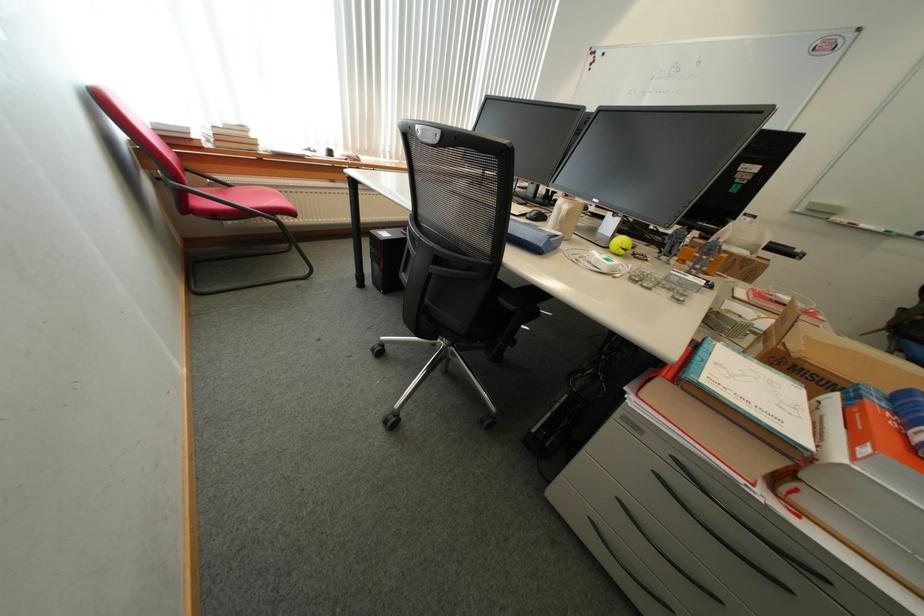
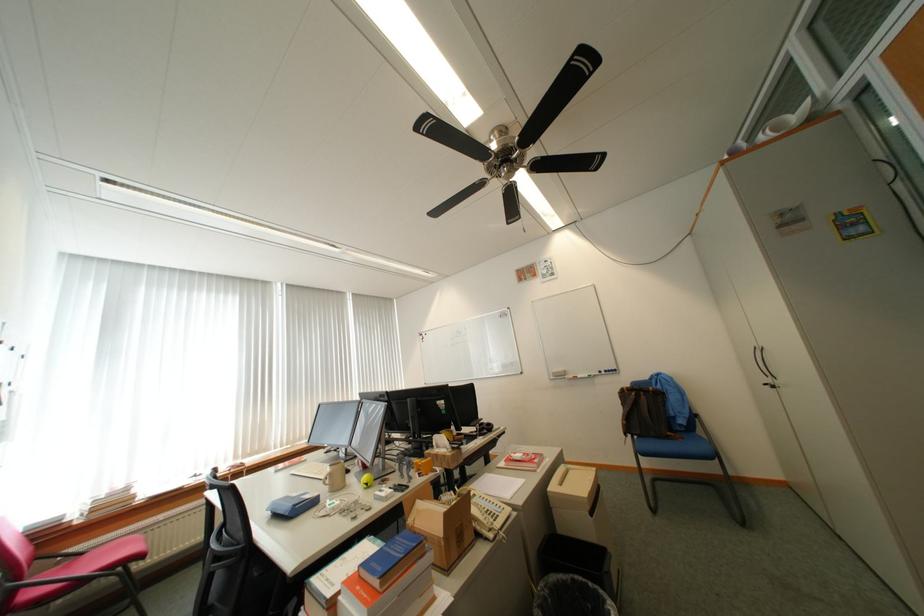
Locate, in the second image, the point that corresponds to point 237,187 in the first image.

(91, 554)